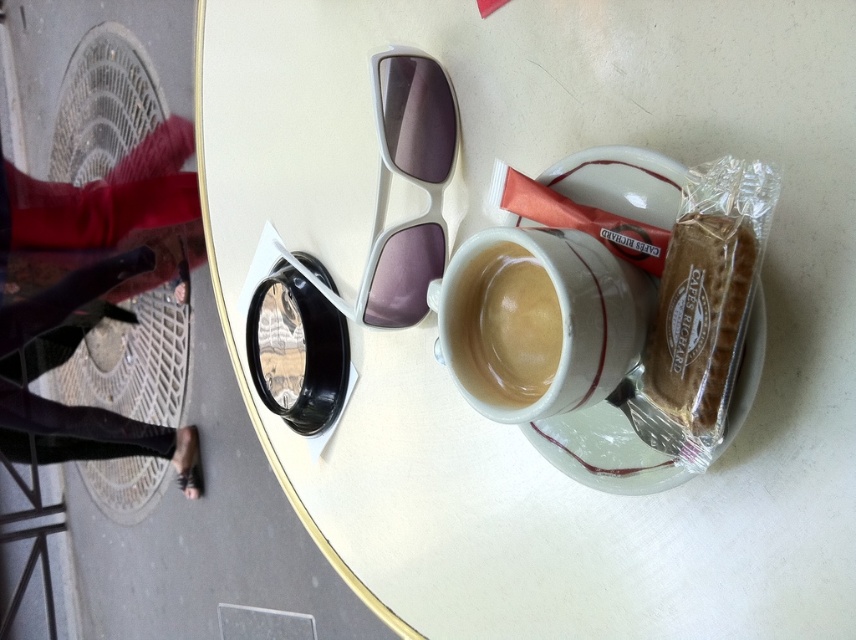
You are organizing items on a table and need to place a new item between the brown paper bag at upper right and the white porcelain saucer at upper center. Considering their sizes, which object should you place the new item closer to?

The new item should be placed closer to the brown paper bag at upper right because it occupies less space than the white porcelain saucer at upper center, allowing more room for the new item near the saucer.

What are the coordinates of the black leather pants at lower left?

The black leather pants at lower left are located at coordinates point [92,292].